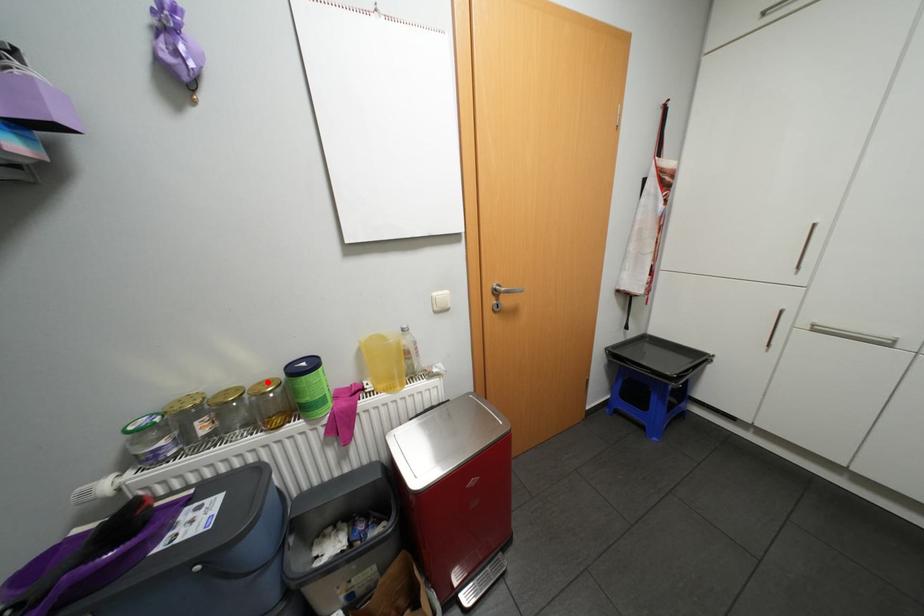
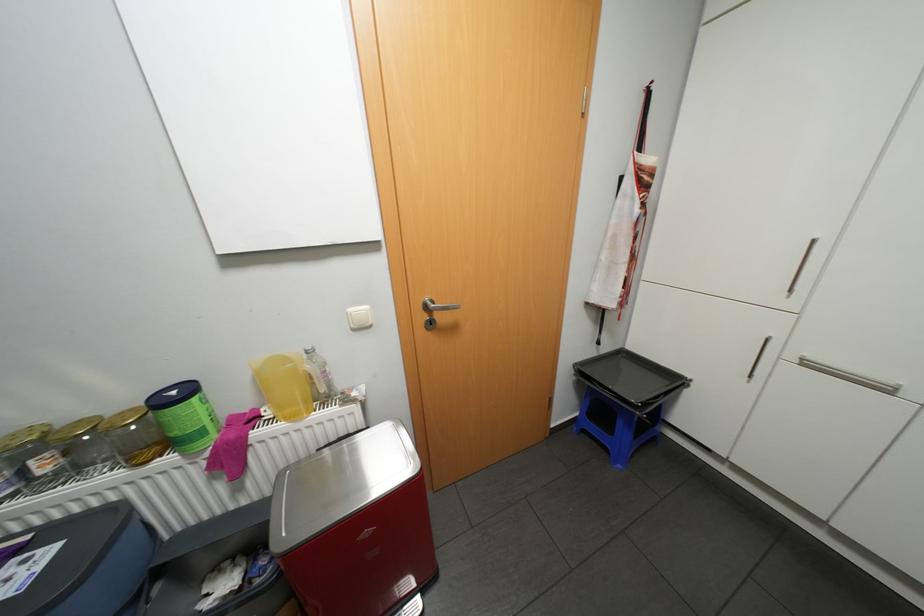
Where in the second image is the point corresponding to the highlighted location from the first image?

(128, 411)